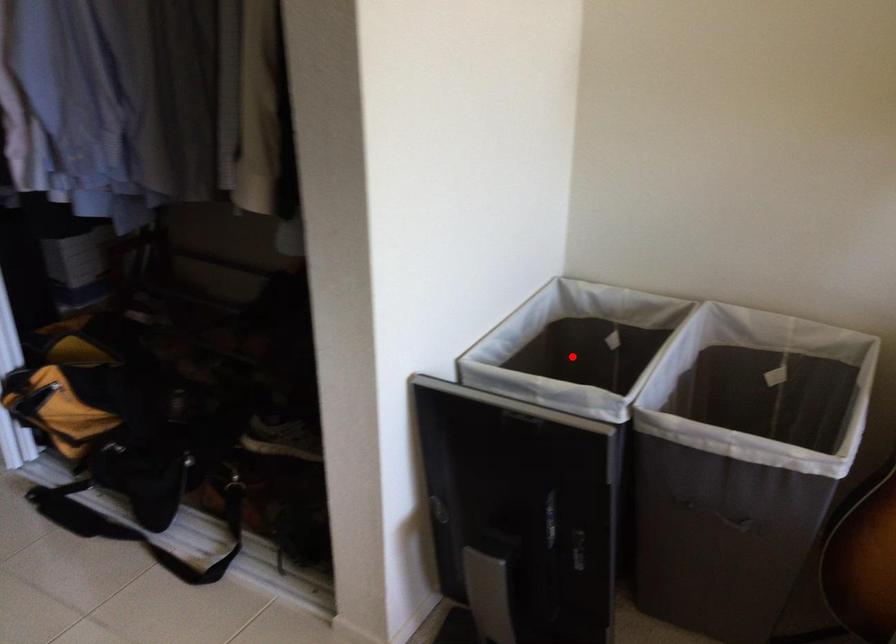
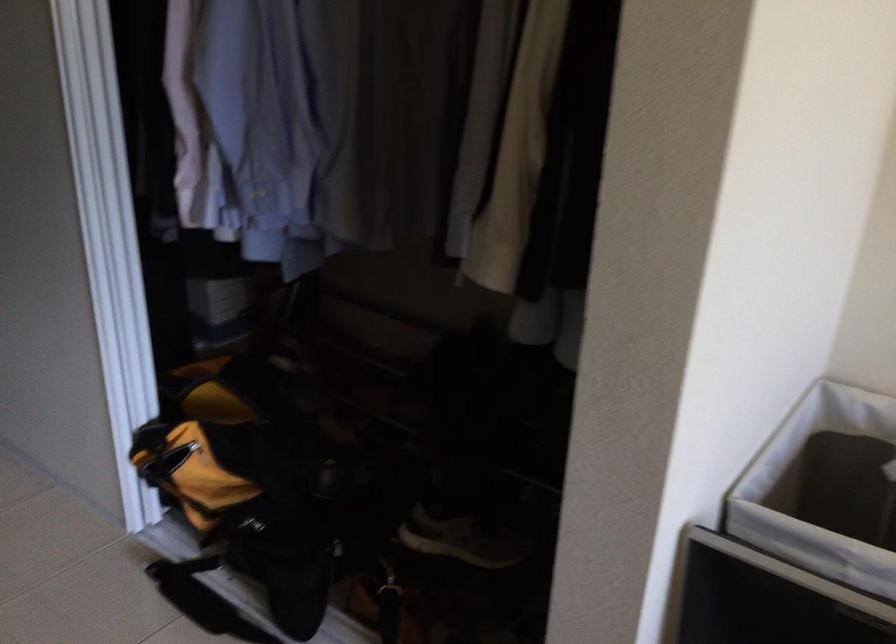
Where in the second image is the point corresponding to the highlighted location from the first image?

(824, 489)